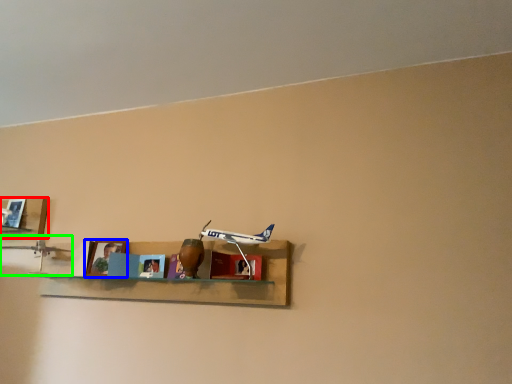
Question: Which is farther away from shelf (highlighted by a red box)? picture frame (highlighted by a blue box) or toy (highlighted by a green box)?

Choices:
 (A) picture frame
 (B) toy

Answer: (A)